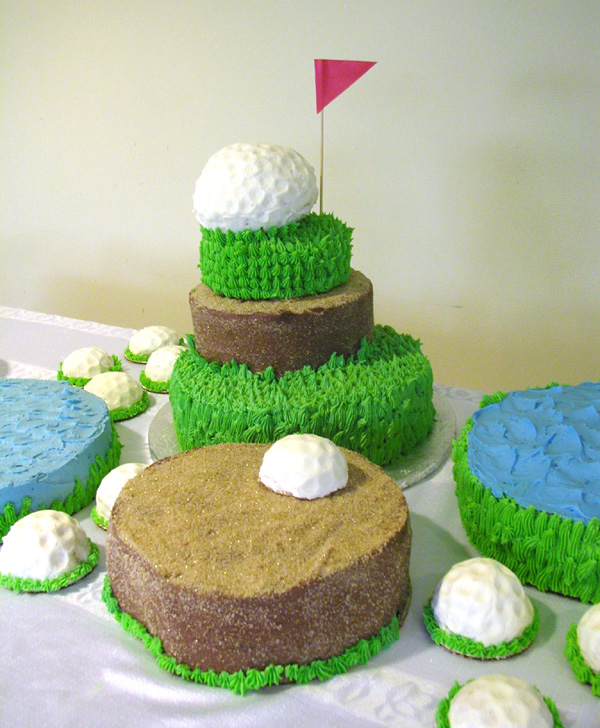
This screenshot has height=728, width=600. I want to click on tablecloth, so click(81, 665).